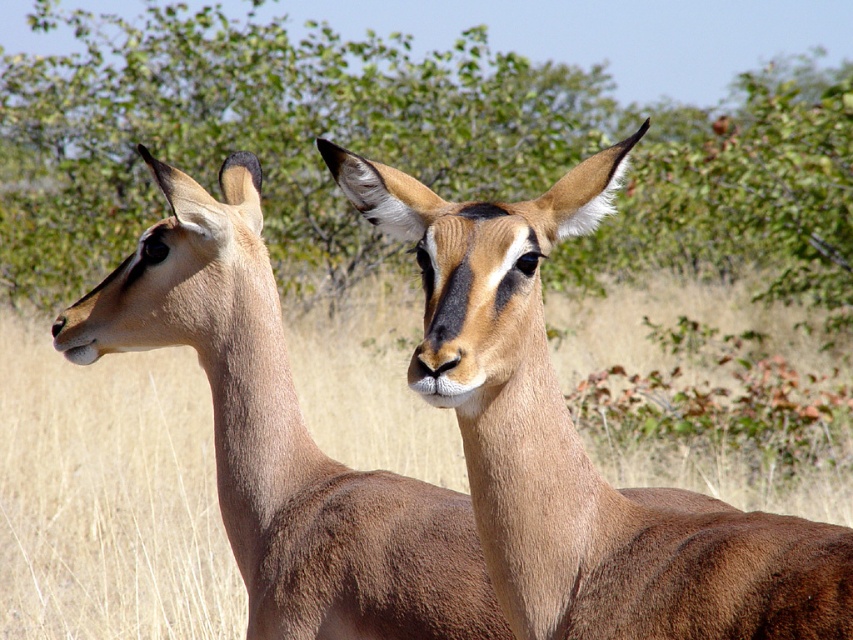
Question: Is green leafy tree at upper center wider than brown fur antelope at center?

Choices:
 (A) no
 (B) yes

Answer: (B)

Question: Which of the following is the closest to the observer?

Choices:
 (A) green leafy tree at upper center
 (B) brown fur antelope at center

Answer: (B)

Question: From the image, what is the correct spatial relationship of green leafy tree at upper center in relation to brown fur antelope at center?

Choices:
 (A) right
 (B) left

Answer: (B)

Question: Which object is the closest to the green leafy tree at upper center?

Choices:
 (A) brown fur antelope at center
 (B) brown smooth antelope at center

Answer: (A)

Question: Is green leafy tree at upper center above brown fur antelope at center?

Choices:
 (A) no
 (B) yes

Answer: (B)

Question: Which object is positioned closest to the brown smooth antelope at center?

Choices:
 (A) brown fur antelope at center
 (B) green leafy tree at upper center

Answer: (A)